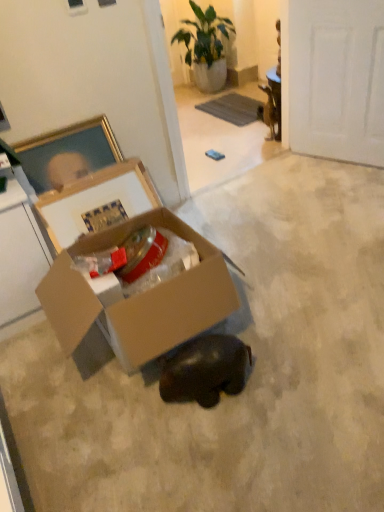
This screenshot has height=512, width=384. In order to click on vacant space underneath white matte door at upper right (from a real-world perspective) in this screenshot , I will do `click(343, 163)`.